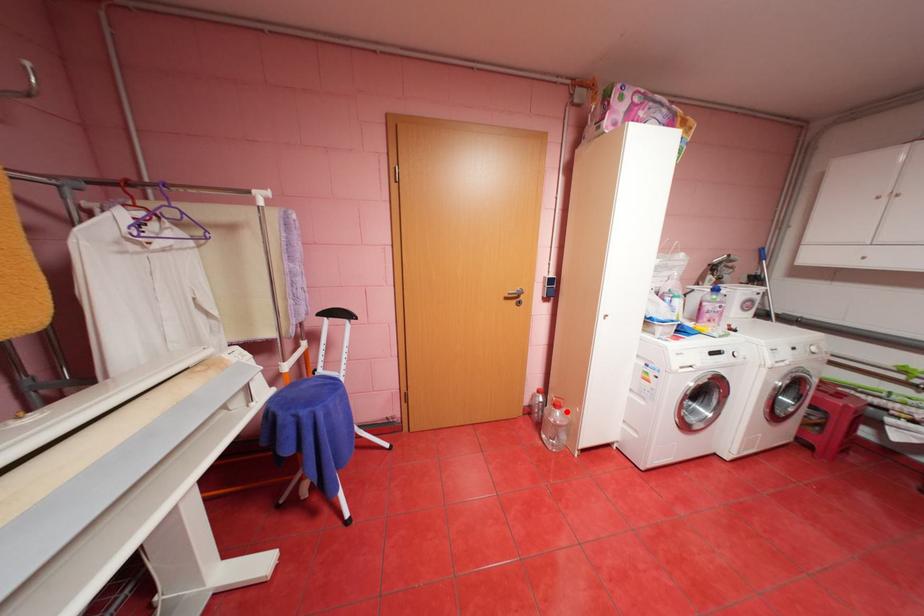
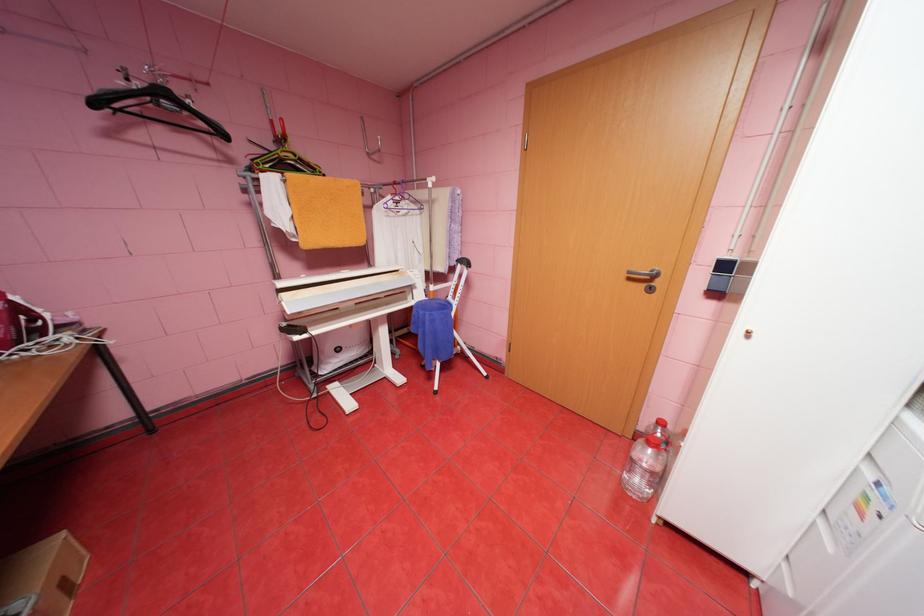
Question: I am providing you with two images of the same scene from different viewpoints. Image1 has a red point marked. In image2, the corresponding 3D location appears at what relative position? Reply with the corresponding letter.

Choices:
 (A) Closer
 (B) Farther

Answer: (A)